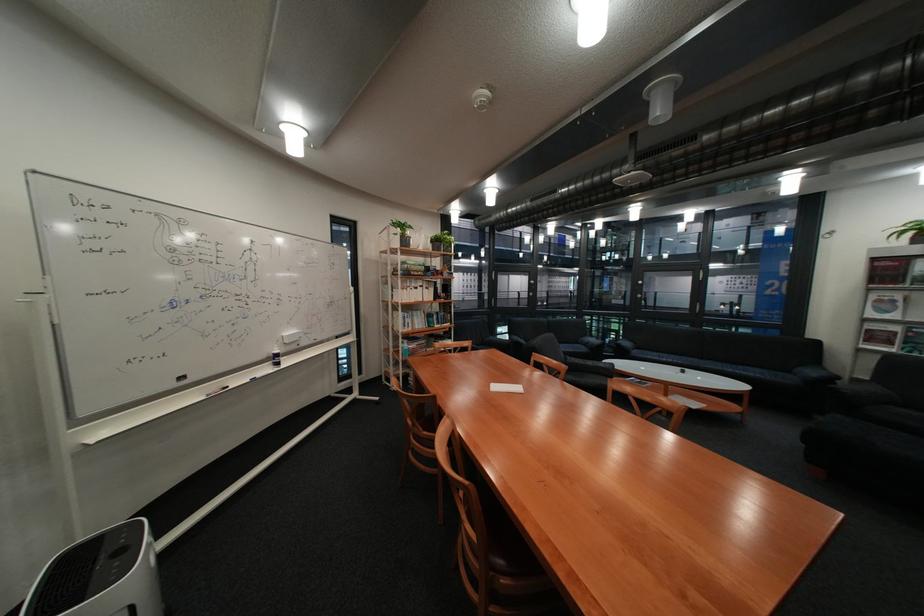
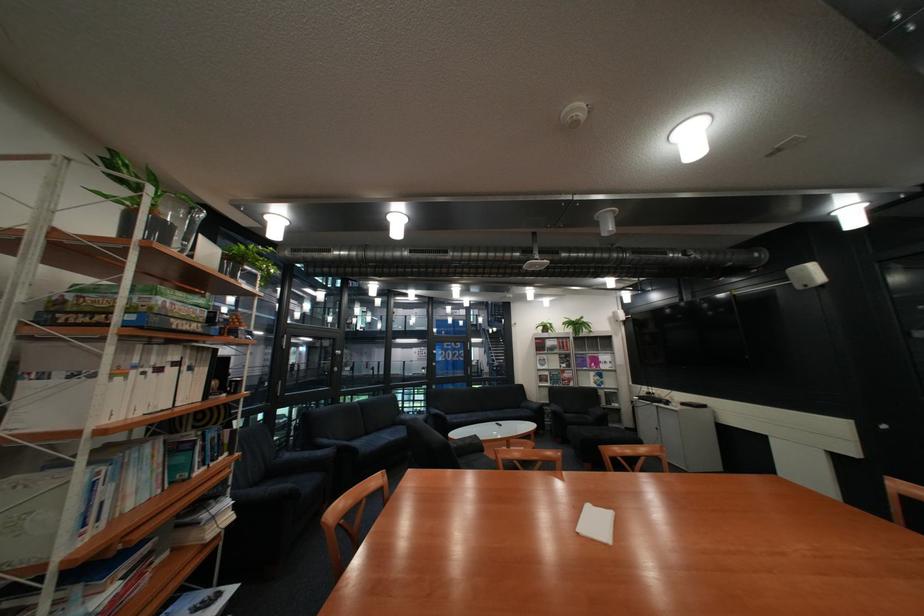
Find the pixel in the second image that matches (x=419, y=290) in the first image.

(134, 379)